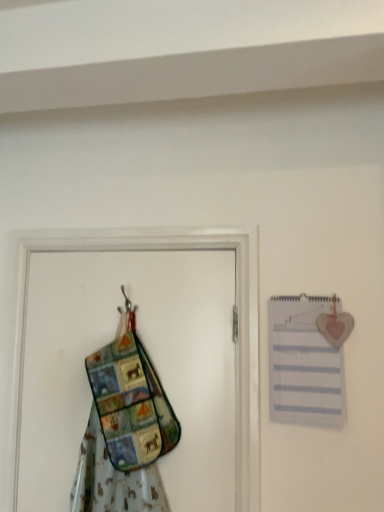
Question: Could you tell me if multicolored fabric apron at left is turned towards white paper journal at upper right?

Choices:
 (A) yes
 (B) no

Answer: (B)

Question: From the image's perspective, is multicolored fabric apron at left above white paper journal at upper right?

Choices:
 (A) no
 (B) yes

Answer: (A)

Question: From the image's perspective, would you say multicolored fabric apron at left is shown under white paper journal at upper right?

Choices:
 (A) no
 (B) yes

Answer: (B)

Question: Is multicolored fabric apron at left not near white paper journal at upper right?

Choices:
 (A) no
 (B) yes

Answer: (A)

Question: Does multicolored fabric apron at left have a greater width compared to white paper journal at upper right?

Choices:
 (A) no
 (B) yes

Answer: (B)

Question: Is multicolored fabric apron at left positioned before white paper journal at upper right?

Choices:
 (A) yes
 (B) no

Answer: (A)

Question: Could you tell me if multicolored fabric screen door at left is facing white paper journal at upper right?

Choices:
 (A) no
 (B) yes

Answer: (A)

Question: Considering the relative sizes of multicolored fabric screen door at left and white paper journal at upper right in the image provided, is multicolored fabric screen door at left thinner than white paper journal at upper right?

Choices:
 (A) yes
 (B) no

Answer: (B)

Question: Is multicolored fabric screen door at left positioned with its back to white paper journal at upper right?

Choices:
 (A) yes
 (B) no

Answer: (B)

Question: From the image's perspective, is multicolored fabric screen door at left above white paper journal at upper right?

Choices:
 (A) yes
 (B) no

Answer: (B)

Question: Can you confirm if multicolored fabric screen door at left is wider than white paper journal at upper right?

Choices:
 (A) yes
 (B) no

Answer: (A)

Question: Can you confirm if multicolored fabric screen door at left is taller than white paper journal at upper right?

Choices:
 (A) no
 (B) yes

Answer: (B)

Question: From the image's perspective, is white paper journal at upper right located beneath multicolored fabric screen door at left?

Choices:
 (A) no
 (B) yes

Answer: (A)